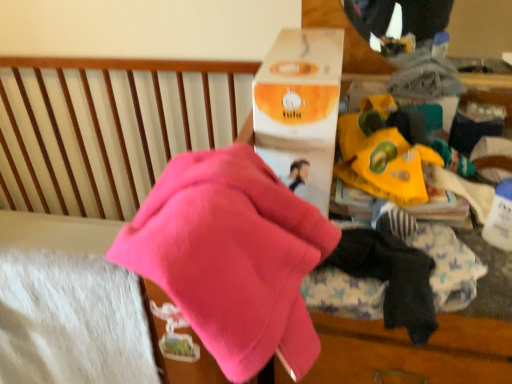
Question: Is orange matte cardboard box at upper center closer to camera compared to yellow paper bag at center?

Choices:
 (A) yes
 (B) no

Answer: (A)

Question: Is orange matte cardboard box at upper center not near yellow paper bag at center?

Choices:
 (A) no
 (B) yes

Answer: (A)

Question: From a real-world perspective, does orange matte cardboard box at upper center stand above yellow paper bag at center?

Choices:
 (A) yes
 (B) no

Answer: (A)

Question: Does orange matte cardboard box at upper center turn towards yellow paper bag at center?

Choices:
 (A) yes
 (B) no

Answer: (B)

Question: Does orange matte cardboard box at upper center have a greater width compared to yellow paper bag at center?

Choices:
 (A) yes
 (B) no

Answer: (A)

Question: Considering the positions of orange matte cardboard box at upper center and yellow paper bag at center in the image, is orange matte cardboard box at upper center taller or shorter than yellow paper bag at center?

Choices:
 (A) tall
 (B) short

Answer: (A)

Question: From a real-world perspective, is orange matte cardboard box at upper center positioned above or below yellow paper bag at center?

Choices:
 (A) above
 (B) below

Answer: (A)

Question: Is orange matte cardboard box at upper center to the left or to the right of yellow paper bag at center in the image?

Choices:
 (A) left
 (B) right

Answer: (A)

Question: Considering the positions of orange matte cardboard box at upper center and yellow paper bag at center in the image, is orange matte cardboard box at upper center wider or thinner than yellow paper bag at center?

Choices:
 (A) wide
 (B) thin

Answer: (A)

Question: Is dark blue cotton socks at lower right inside or outside of pink fleece at center?

Choices:
 (A) outside
 (B) inside

Answer: (A)

Question: Considering the positions of dark blue cotton socks at lower right and pink fleece at center in the image, is dark blue cotton socks at lower right wider or thinner than pink fleece at center?

Choices:
 (A) wide
 (B) thin

Answer: (B)

Question: Looking at the image, does dark blue cotton socks at lower right seem bigger or smaller compared to pink fleece at center?

Choices:
 (A) big
 (B) small

Answer: (B)

Question: From the image's perspective, is dark blue cotton socks at lower right located above or below pink fleece at center?

Choices:
 (A) below
 (B) above

Answer: (A)

Question: From the image's perspective, relative to orange matte cardboard box at upper center, is pink fleece at center above or below?

Choices:
 (A) above
 (B) below

Answer: (B)

Question: Is point (280, 337) closer or farther from the camera than point (323, 142)?

Choices:
 (A) closer
 (B) farther

Answer: (A)